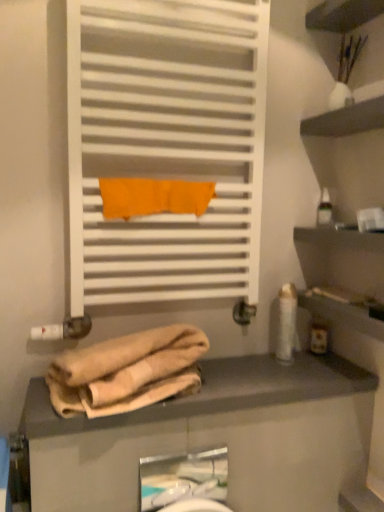
Where is `white glossy lotion at right, marked as the third toiletry in a right-to-left arrangement`? This screenshot has height=512, width=384. white glossy lotion at right, marked as the third toiletry in a right-to-left arrangement is located at coordinates (287, 324).

What are the coordinates of `beige cotton towel at lower center` in the screenshot? It's located at (126, 371).

This screenshot has width=384, height=512. Identify the location of orange fabric towel at center. (153, 197).

Locate an element on the screen. This screenshot has height=512, width=384. beige fabric at lower center is located at coordinates (x=215, y=436).

At what (x,y) coordinates should I click in order to perform the action: click on white matte towel rack at upper center. Please return your answer as a coordinate pair (x, y). This screenshot has width=384, height=512. Looking at the image, I should click on click(x=166, y=145).

Where is `white glossy lotion at right, the 1th toiletry in the left-to-right sequence`? This screenshot has width=384, height=512. white glossy lotion at right, the 1th toiletry in the left-to-right sequence is located at coordinates (287, 324).

In terms of width, does beige fabric at lower center look wider or thinner when compared to white glossy lotion at right, the 2th toiletry positioned from the bottom?

beige fabric at lower center is wider than white glossy lotion at right, the 2th toiletry positioned from the bottom.

Is beige fabric at lower center looking in the opposite direction of white glossy lotion at right, the 1th toiletry in the left-to-right sequence?

No, beige fabric at lower center is not facing the opposite direction of white glossy lotion at right, the 1th toiletry in the left-to-right sequence.

Between beige fabric at lower center and white glossy lotion at right, the 1th toiletry in the left-to-right sequence, which one appears on the left side from the viewer's perspective?

beige fabric at lower center is more to the left.

Visually, is orange fabric towel at center positioned to the left or to the right of beige cotton towel at lower center?

Based on their positions, orange fabric towel at center is located to the right of beige cotton towel at lower center.

Can we say orange fabric towel at center lies outside beige cotton towel at lower center?

Yes, orange fabric towel at center is not within beige cotton towel at lower center.

Is orange fabric towel at center looking in the opposite direction of beige cotton towel at lower center?

No.

Is point (175, 186) more distant than point (92, 372)?

Yes, it is.

Considering the relative positions of white matte towel rack at upper center and transparent plastic bottle at upper right, the first toiletry positioned from the right, in the image provided, is white matte towel rack at upper center to the right of transparent plastic bottle at upper right, the first toiletry positioned from the right, from the viewer's perspective?

In fact, white matte towel rack at upper center is to the left of transparent plastic bottle at upper right, the first toiletry positioned from the right.

Is white matte towel rack at upper center thinner than transparent plastic bottle at upper right, the first toiletry positioned from the right?

Incorrect, the width of white matte towel rack at upper center is not less than that of transparent plastic bottle at upper right, the first toiletry positioned from the right.

From a real-world perspective, who is located lower, white matte towel rack at upper center or transparent plastic bottle at upper right, which is counted as the 1th toiletry, starting from the top?

From a 3D spatial view, transparent plastic bottle at upper right, which is counted as the 1th toiletry, starting from the top, is below.

How distant is white glossy sink at lower center from white matte towel rack at upper center?

The distance of white glossy sink at lower center from white matte towel rack at upper center is 30.82 inches.

Is white glossy sink at lower center bigger than white matte towel rack at upper center?

No.

How different are the orientations of white glossy sink at lower center and white matte towel rack at upper center in degrees?

The angle between the facing direction of white glossy sink at lower center and the facing direction of white matte towel rack at upper center is 1.62 degrees.

Does white glossy sink at lower center appear on the right side of white matte towel rack at upper center?

Indeed, white glossy sink at lower center is positioned on the right side of white matte towel rack at upper center.

Is white glossy sink at lower center to the left of beige fabric at lower center from the viewer's perspective?

Indeed, white glossy sink at lower center is positioned on the left side of beige fabric at lower center.

From the image's perspective, would you say white glossy sink at lower center is positioned over beige fabric at lower center?

No, from the image's perspective, white glossy sink at lower center is not over beige fabric at lower center.

Consider the image. Is white glossy sink at lower center aimed at beige fabric at lower center?

No, white glossy sink at lower center is not aimed at beige fabric at lower center.

Is orange fabric towel at center far from white matte towel rack at upper center?

No.

Considering the sizes of orange fabric towel at center and white matte towel rack at upper center in the image, is orange fabric towel at center wider or thinner than white matte towel rack at upper center?

Clearly, orange fabric towel at center has less width compared to white matte towel rack at upper center.

Is white matte towel rack at upper center a part of orange fabric towel at center?

That's incorrect, white matte towel rack at upper center is not inside orange fabric towel at center.

Consider the image. Is orange fabric towel at center behind white matte towel rack at upper center?

Yes, orange fabric towel at center is further from the viewer.

Identify the location of bath towel behind the white glossy sink at lower center. The width and height of the screenshot is (384, 512). (153, 197).

From the image's perspective, which is above, white glossy sink at lower center or orange fabric towel at center?

From the image's view, orange fabric towel at center is above.

Which is behind, white glossy sink at lower center or orange fabric towel at center?

orange fabric towel at center is more distant.

Does white glossy sink at lower center appear on the left side of orange fabric towel at center?

Incorrect, white glossy sink at lower center is not on the left side of orange fabric towel at center.

Find the location of a particular element. This screenshot has height=512, width=384. the 2nd toiletry above the beige fabric at lower center (from the image's perspective) is located at coordinates (287, 324).

Identify the location of towel below the orange fabric towel at center (from a real-world perspective). (126, 371).

Based on their spatial positions, is white matte towel rack at upper center or transparent plastic bottle at upper right, the 3th toiletry in the bottom-to-top sequence, further from white glossy lotion at right, marked as the third toiletry in a right-to-left arrangement?

white matte towel rack at upper center lies further to white glossy lotion at right, marked as the third toiletry in a right-to-left arrangement, than the other object.

Estimate the real-world distances between objects in this image. Which object is further from white glossy sink at lower center, white matte towel rack at upper center or transparent plastic bottle at upper right, the third toiletry viewed from the left?

The object further to white glossy sink at lower center is transparent plastic bottle at upper right, the third toiletry viewed from the left.

Which object lies nearer to the anchor point orange fabric towel at center, beige cotton towel at lower center or white glossy sink at lower center?

beige cotton towel at lower center is positioned closer to the anchor orange fabric towel at center.

Estimate the real-world distances between objects in this image. Which object is closer to beige fabric at lower center, white glossy lotion at right, the 1th toiletry in the left-to-right sequence, or white matte towel rack at upper center?

white glossy lotion at right, the 1th toiletry in the left-to-right sequence.

Looking at the image, which one is located closer to white glossy lotion at right, marked as the third toiletry in a right-to-left arrangement, beige fabric at lower center or white matte towel rack at upper center?

beige fabric at lower center is positioned closer to the anchor white glossy lotion at right, marked as the third toiletry in a right-to-left arrangement.

From the image, which object appears to be nearer to transparent plastic bottle at upper right, the first toiletry positioned from the right, translucent plastic bottle at right, positioned as the third toiletry in top-to-bottom order, or beige fabric at lower center?

Based on the image, translucent plastic bottle at right, positioned as the third toiletry in top-to-bottom order, appears to be nearer to transparent plastic bottle at upper right, the first toiletry positioned from the right.

Considering their positions, is white glossy lotion at right, which is the second toiletry in top-to-bottom order, positioned further to white glossy sink at lower center than beige fabric at lower center?

white glossy lotion at right, which is the second toiletry in top-to-bottom order, is further to white glossy sink at lower center.

Estimate the real-world distances between objects in this image. Which object is closer to translucent plastic bottle at right, which is counted as the second toiletry, starting from the left, beige fabric at lower center or white matte towel rack at upper center?

beige fabric at lower center is positioned closer to the anchor translucent plastic bottle at right, which is counted as the second toiletry, starting from the left.

Identify the location of counter between white glossy lotion at right, the 2th toiletry positioned from the bottom, and white glossy sink at lower center vertically. Image resolution: width=384 pixels, height=512 pixels. (215, 436).

Find the location of `counter that lies between orange fabric towel at center and white glossy sink at lower center from top to bottom`. counter that lies between orange fabric towel at center and white glossy sink at lower center from top to bottom is located at coordinates (215, 436).

Locate an element on the screen. bath towel that lies between transparent plastic bottle at upper right, which is counted as the 1th toiletry, starting from the top, and beige fabric at lower center from top to bottom is located at coordinates (153, 197).

The height and width of the screenshot is (512, 384). I want to click on towel between orange fabric towel at center and white glossy sink at lower center vertically, so click(x=126, y=371).